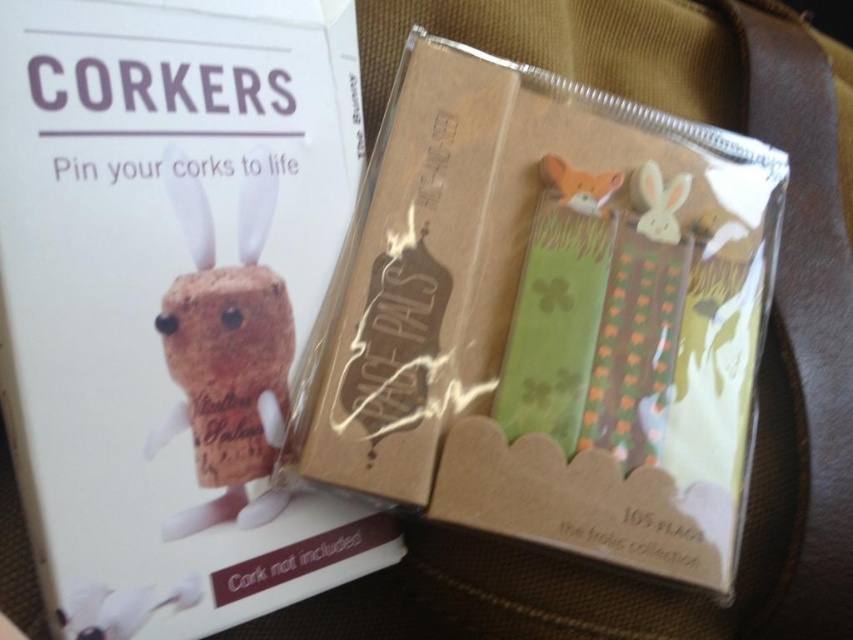
You are organizing a craft fair and have two items to display on a shelf. You have a matte brown cork at upper left and a white matte bunny at upper right. If you want to arrange them so the larger item is on the left side of the shelf, which item should you place on the left?

The matte brown cork at upper left is larger than the white matte bunny at upper right, so you should place the matte brown cork at upper left on the left side of the shelf.

You are holding a ruler and want to measure the distance between the point at coordinates (196, 262) and your eyes. According to the image description, what is this distance?

The distance between the point at coordinates (196, 262) and the viewer is 63.80 centimeters.